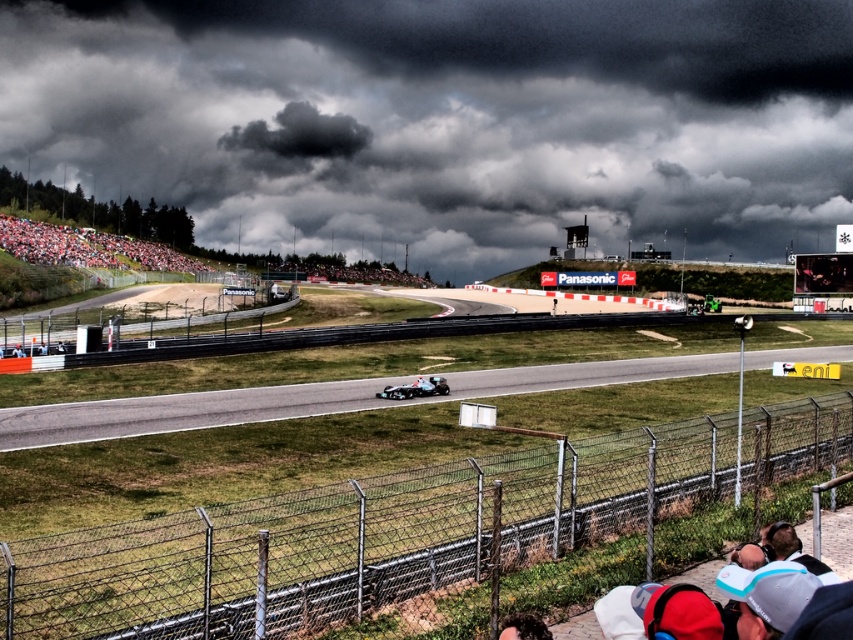
Question: Which object is the farthest from the silver metallic race car at center?

Choices:
 (A) smooth asphalt track at center
 (B) red fabric crowd at left
 (C) dark gray cloud at upper center

Answer: (C)

Question: Considering the relative positions of white plastic cap at lower right and curly hair at lower center in the image provided, where is white plastic cap at lower right located with respect to curly hair at lower center?

Choices:
 (A) left
 (B) right

Answer: (B)

Question: Does smooth asphalt track at center appear on the right side of curly hair at lower center?

Choices:
 (A) yes
 (B) no

Answer: (A)

Question: Estimate the real-world distances between objects in this image. Which object is closer to the white plastic cap at lower right?

Choices:
 (A) curly hair at lower center
 (B) smooth asphalt track at center

Answer: (A)

Question: Which is nearer to the white plastic cap at lower right?

Choices:
 (A) curly hair at lower center
 (B) dark gray cloud at upper center
 (C) smooth asphalt track at center
 (D) red fabric crowd at left

Answer: (A)

Question: Does smooth asphalt track at center have a larger size compared to red fabric crowd at left?

Choices:
 (A) yes
 (B) no

Answer: (B)